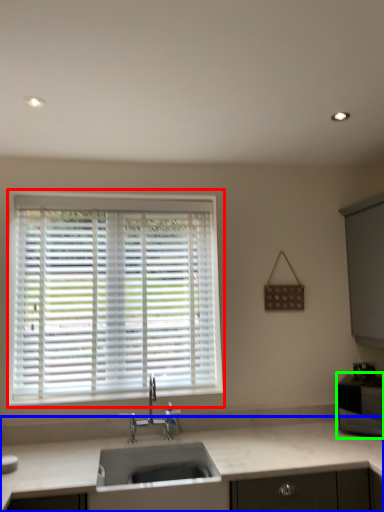
Question: Which is farther away from window (highlighted by a red box)? countertop (highlighted by a blue box) or appliance (highlighted by a green box)?

Choices:
 (A) countertop
 (B) appliance

Answer: (B)